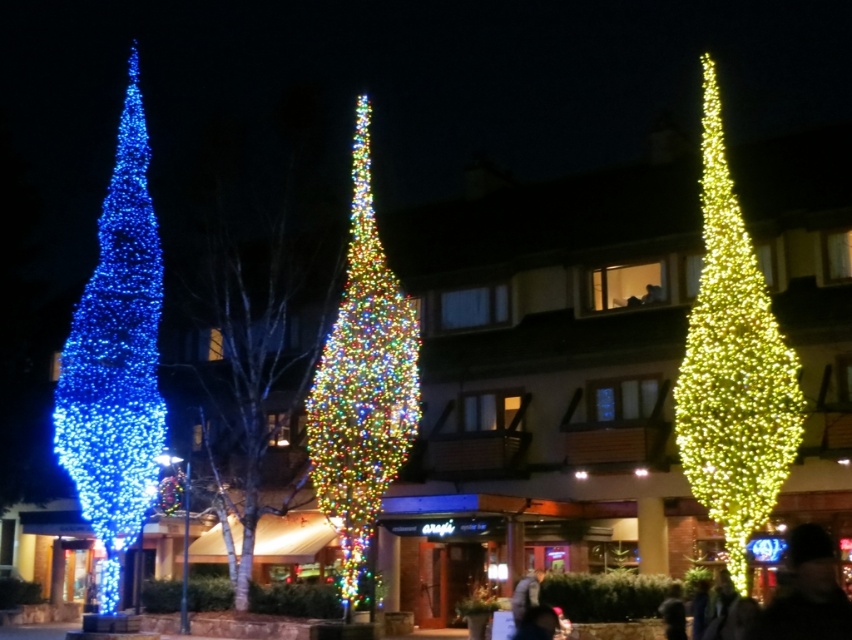
Question: Which point is closer to the camera?

Choices:
 (A) (355, 134)
 (B) (137, 282)
 (C) (763, 371)

Answer: (C)

Question: Observing the image, what is the correct spatial positioning of blue glossy christmas tree at left in reference to multicolored lights at center?

Choices:
 (A) above
 (B) below

Answer: (B)

Question: Is shiny gold christmas tree at right below blue glittering lights at left?

Choices:
 (A) yes
 (B) no

Answer: (B)

Question: Based on their relative distances, which object is nearer to the blue glossy christmas tree at left?

Choices:
 (A) multicolored lights at center
 (B) blue glittering lights at left
 (C) shiny gold christmas tree at right

Answer: (A)

Question: Can you confirm if shiny gold christmas tree at right is positioned to the right of multicolored lights at center?

Choices:
 (A) no
 (B) yes

Answer: (B)

Question: Which point is farther to the camera?

Choices:
 (A) shiny gold christmas tree at right
 (B) blue glossy christmas tree at left

Answer: (B)